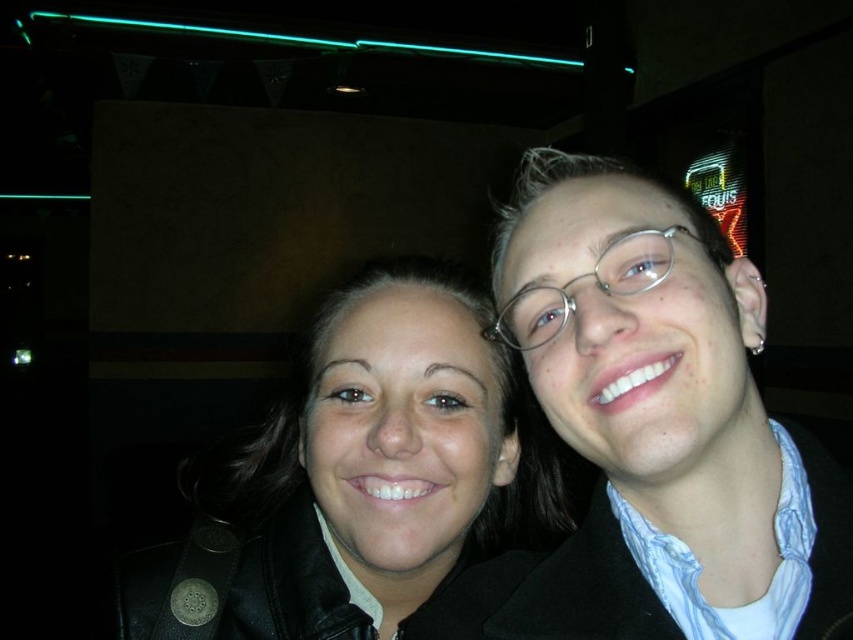
In order to click on black leather jacket at center in this screenshot , I will do `click(612, 445)`.

Is black leather jacket at center taller than silver/glassy eyeglasses at center-right?

Indeed, black leather jacket at center has a greater height compared to silver/glassy eyeglasses at center-right.

Describe the element at coordinates (612, 445) in the screenshot. The height and width of the screenshot is (640, 853). I see `black leather jacket at center` at that location.

This screenshot has width=853, height=640. I want to click on black leather jacket at center, so point(612,445).

Is matte black jacket at right to the left of matte black jacket at center from the viewer's perspective?

In fact, matte black jacket at right is to the right of matte black jacket at center.

Is point (726, 410) farther from viewer compared to point (560, 508)?

No.

Where is `matte black jacket at right`? matte black jacket at right is located at coordinates (659, 416).

Who is positioned more to the left, matte black jacket at right or silver/glassy eyeglasses at center-right?

From the viewer's perspective, silver/glassy eyeglasses at center-right appears more on the left side.

Can you confirm if matte black jacket at right is bigger than silver/glassy eyeglasses at center-right?

Correct, matte black jacket at right is larger in size than silver/glassy eyeglasses at center-right.

Is point (639, 280) positioned before point (636, 285)?

No, it is not.

The image size is (853, 640). Identify the location of matte black jacket at right. (659, 416).